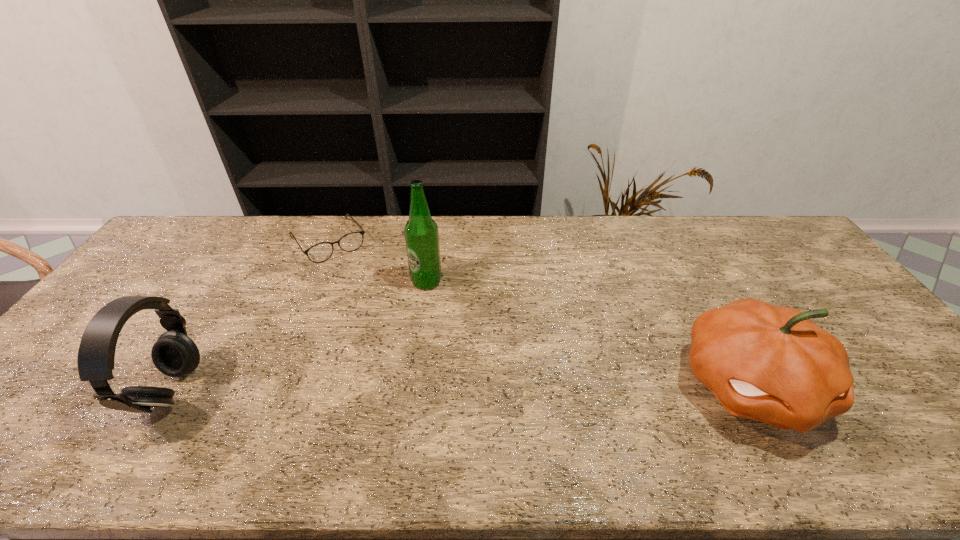
In the image, there is a desktop. At what (x,y) coordinates should I click in order to perform the action: click on vacant space at the near right corner. Please return your answer as a coordinate pair (x, y). The height and width of the screenshot is (540, 960). Looking at the image, I should click on (950, 419).

Locate an element on the screen. This screenshot has height=540, width=960. empty location between the third object from right to left and the second object from right to left is located at coordinates (377, 261).

You are a GUI agent. You are given a task and a screenshot of the screen. Output one action in this format:
    pyautogui.click(x=<x>, y=<y>)
    Task: Click on the vacant space that is in between the earphone and the rightmost object
    The image size is (960, 540).
    Given the screenshot: What is the action you would take?
    pyautogui.click(x=461, y=389)

Locate an element on the screen. unoccupied area between the spectacles and the second object from right to left is located at coordinates (377, 261).

Find the location of `unoccupied position between the beer bottle and the farthest object`. unoccupied position between the beer bottle and the farthest object is located at coordinates (377, 261).

Image resolution: width=960 pixels, height=540 pixels. I want to click on empty space that is in between the second object from right to left and the rightmost object, so click(x=588, y=334).

Where is `free space between the beer bottle and the earphone`? This screenshot has width=960, height=540. free space between the beer bottle and the earphone is located at coordinates pos(300,337).

Identify the location of empty space that is in between the earphone and the third object from left to right. Image resolution: width=960 pixels, height=540 pixels. (300, 337).

Identify the location of free area in between the farthest object and the leftmost object. The height and width of the screenshot is (540, 960). (251, 317).

Locate an element on the screen. The image size is (960, 540). unoccupied position between the pumpkin and the second object from left to right is located at coordinates (540, 313).